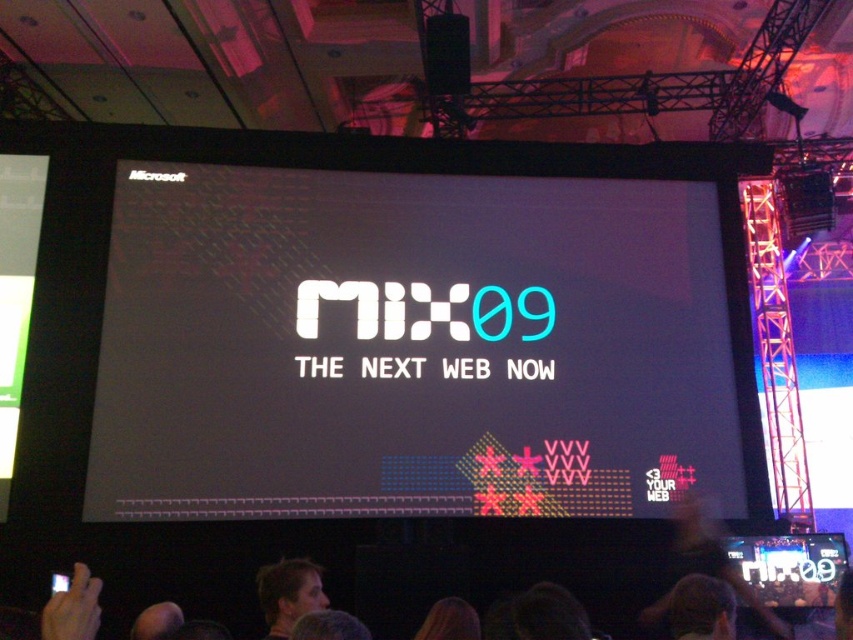
Based on the photo, you are an attendee at the event and notice two people at the front row. One has light brown hair at lower center and the other has dark hair at lower center. Which person is sitting closer to the stage?

The light brown hair at lower center is located above dark hair at lower center, so the light brown hair at lower center is sitting closer to the stage.

You are an event planner setting up a projector for a presentation. The projector is placed at the front of the auditorium, and you need to ensure the white matte text at center is visible on the large screen. Based on its position, can you confirm if the text is centered on the screen?

The white matte text at center is located at point coordinates that are nearly the center of the screen, so yes, it is centered.

Based on the photo, you are a photographer in the audience at this event. You want to capture a photo of the two people at the lower center of the stage, specifically the light brown hair at lower center and the dark hair at lower center. Based on their spatial arrangement, which of the two should you focus on first to ensure both are in frame?

The light brown hair at lower center occupies less space than dark hair at lower center, so you should focus on the dark hair at lower center first to ensure both are in frame.